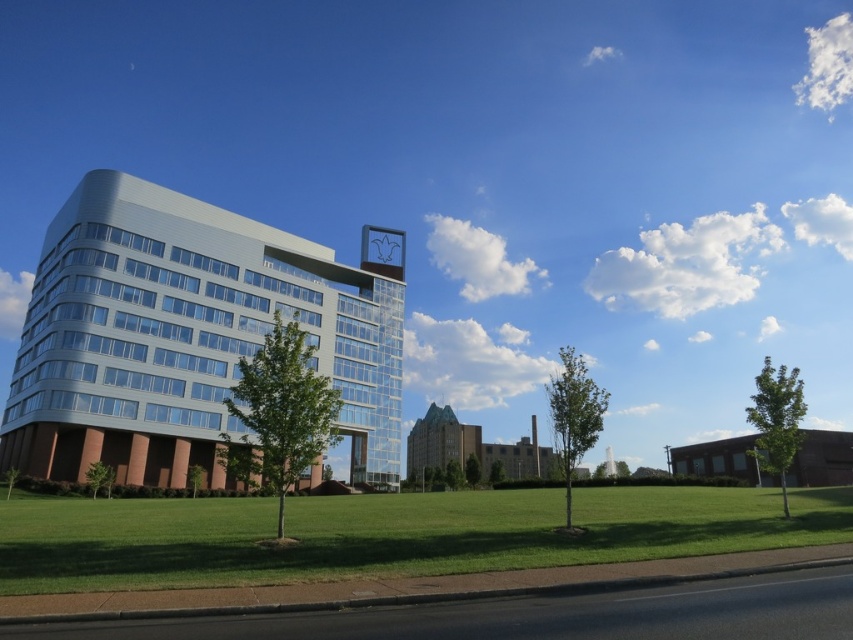
Does metallic glass building at center have a lesser width compared to green grass at lower center?

Yes, metallic glass building at center is thinner than green grass at lower center.

Image resolution: width=853 pixels, height=640 pixels. Describe the element at coordinates (189, 333) in the screenshot. I see `metallic glass building at center` at that location.

Who is more forward, (108, 323) or (728, 520)?

Point (728, 520)

What are the coordinates of `metallic glass building at center` in the screenshot? It's located at (189, 333).